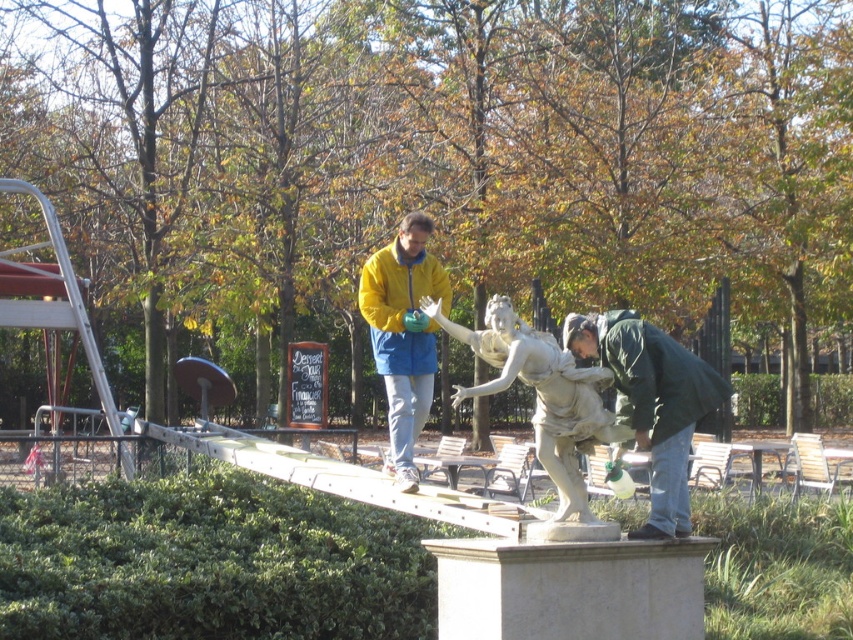
You are standing in the park and want to take a photo of the statue. You notice two points on the statue marked as point A and point B. If point A is at coordinate (575, 502) and point B is at (408, 368), which point is closer to you when you face the statue?

Point A at coordinate (575, 502) is closer to the viewer than point B at (408, 368).

You are a maintenance worker standing near the green matte jacket at lower right and need to reach the white marble statue at center to perform a routine inspection. Given that your reach extends 14 inches, can you comfortably perform the inspection without moving closer?

The distance between the green matte jacket at lower right and the white marble statue at center is 14.24 inches. Since your reach extends 14 inches, you are just slightly out of reach and would need to move closer by approximately 0.24 inches to comfortably perform the inspection.

You are standing at the origin point of the coordinate system in the park. The statue is located at coordinates 0.617, 0.635. If you want to walk directly to the white marble statue at center, in which direction should you head?

You should head towards the coordinates (541, 394), which is the location of the white marble statue at center.